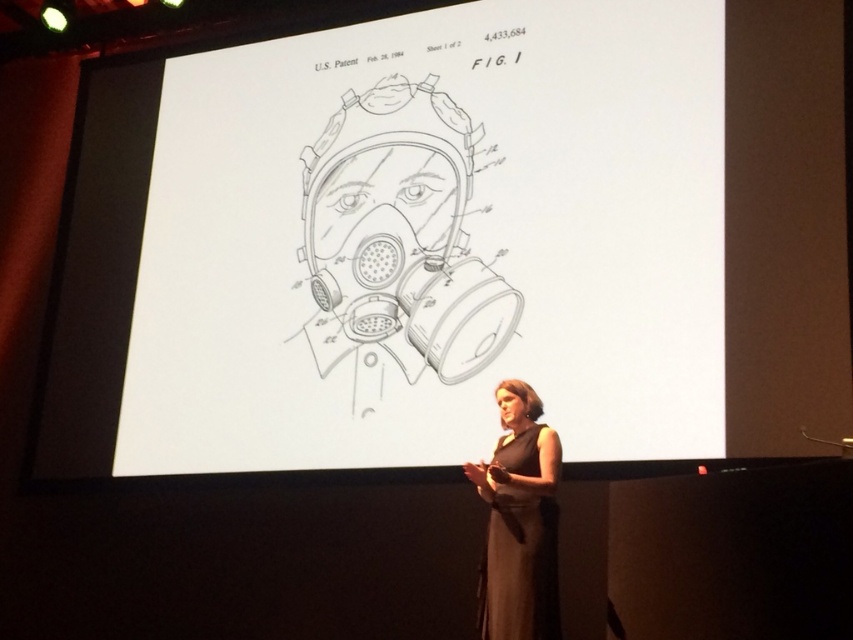
Who is shorter, white paper at center or dark gray dress at center?

dark gray dress at center

Who is positioned more to the right, white paper at center or dark gray dress at center?

Positioned to the right is dark gray dress at center.

Measure the distance between white paper at center and camera.

They are 4.62 meters apart.

What are the coordinates of `white paper at center` in the screenshot? It's located at (396, 244).